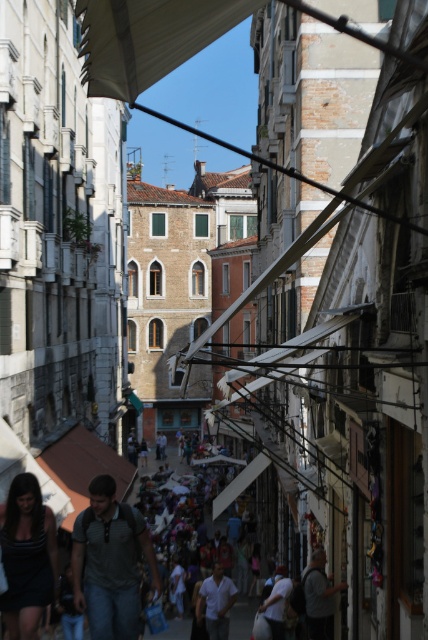
You are a tourist standing on the busy street in the historic European city. You notice two items in the scene described as denim jeans at center and dark gray fabric at lower center. Which item is located higher up in the image?

The denim jeans at center is positioned over dark gray fabric at lower center, so it is higher up in the image.

Based on the photo, you are a tailor observing the denim jeans at center and the dark gray fabric at lower center in the scene. Which item has a larger surface area?

The denim jeans at center has a larger surface area than the dark gray fabric at lower center according to the description.

You are standing on the street and want to locate the white fabric canopy at upper center. According to the coordinates given, where should you look?

The white fabric canopy at upper center is located at coordinates point (148, 38).